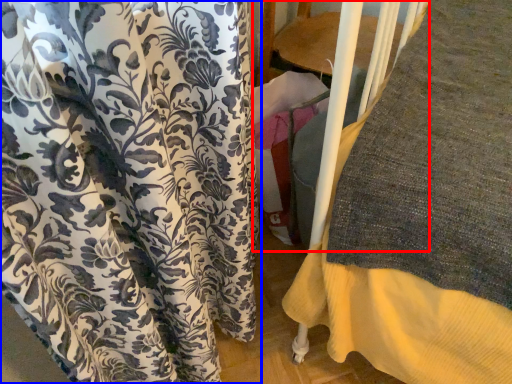
Question: Which point is closer to the camera, bunk bed (highlighted by a red box) or curtain (highlighted by a blue box)?

Choices:
 (A) bunk bed
 (B) curtain

Answer: (B)